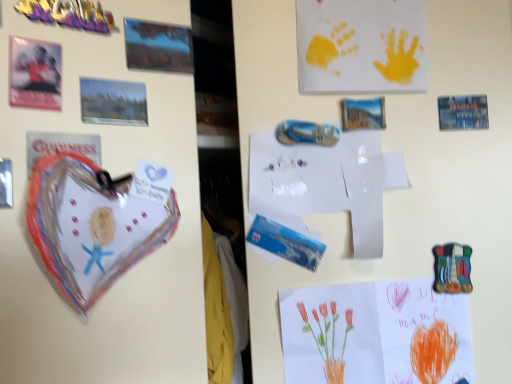
Question: Is point (395, 41) positioned closer to the camera than point (72, 21)?

Choices:
 (A) farther
 (B) closer

Answer: (A)

Question: Is yellow paper handprints at upper center, placed as the first postcard when sorted from back to front, bigger or smaller than metallic/metallic stickers at upper left?

Choices:
 (A) small
 (B) big

Answer: (B)

Question: Which of these objects is positioned closest to the matte plastic postcard at upper left, the third postcard positioned from the top?

Choices:
 (A) yellow paper handprints at upper center, placed as the first postcard when sorted from back to front
 (B) white paper at center
 (C) metallic postcard at upper left, the 3th postcard when ordered from front to back
 (D) watercolor paper flowers at lower right, which appears as the first postcard when ordered from the bottom
 (E) metallic postcard at upper left, positioned as the 4th postcard in right-to-left order

Answer: (E)

Question: Based on their relative distances, which object is farther from the white paper at center?

Choices:
 (A) metallic/metallic stickers at upper left
 (B) yellow paper handprints at upper center, arranged as the fifth postcard when ordered from the bottom
 (C) watercolor paper flowers at lower right, which appears as the first postcard when ordered from the bottom
 (D) matte plastic postcard at upper left, acting as the first postcard starting from the front
 (E) metallic postcard at upper left, which is the 3th postcard in left-to-right order

Answer: (D)